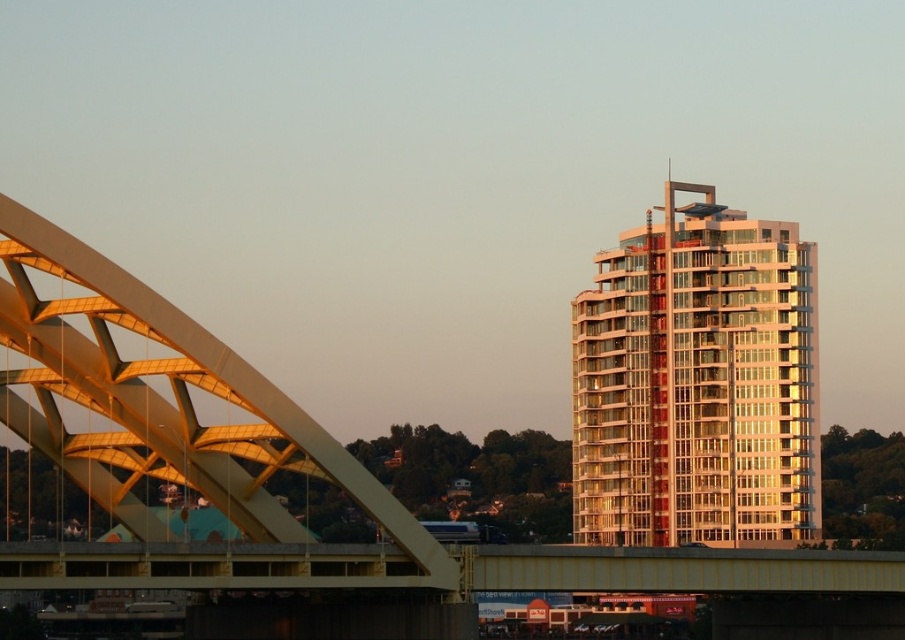
Question: Among these objects, which one is nearest to the camera?

Choices:
 (A) gold reflective glass building at upper right
 (B) golden metallic arch bridge at left

Answer: (B)

Question: Is gold reflective glass building at upper right positioned at the back of golden metallic arch bridge at left?

Choices:
 (A) no
 (B) yes

Answer: (B)

Question: Which of the following is the farthest from the observer?

Choices:
 (A) golden metallic arch bridge at left
 (B) gold reflective glass building at upper right

Answer: (B)

Question: Does gold reflective glass building at upper right lie behind golden metallic arch bridge at left?

Choices:
 (A) yes
 (B) no

Answer: (A)

Question: Does gold reflective glass building at upper right lie in front of golden metallic arch bridge at left?

Choices:
 (A) no
 (B) yes

Answer: (A)